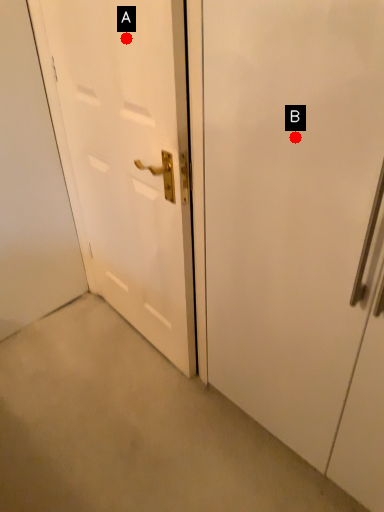
Question: Two points are circled on the image, labeled by A and B beside each circle. Which point is further to the camera?

Choices:
 (A) A is further
 (B) B is further

Answer: (A)